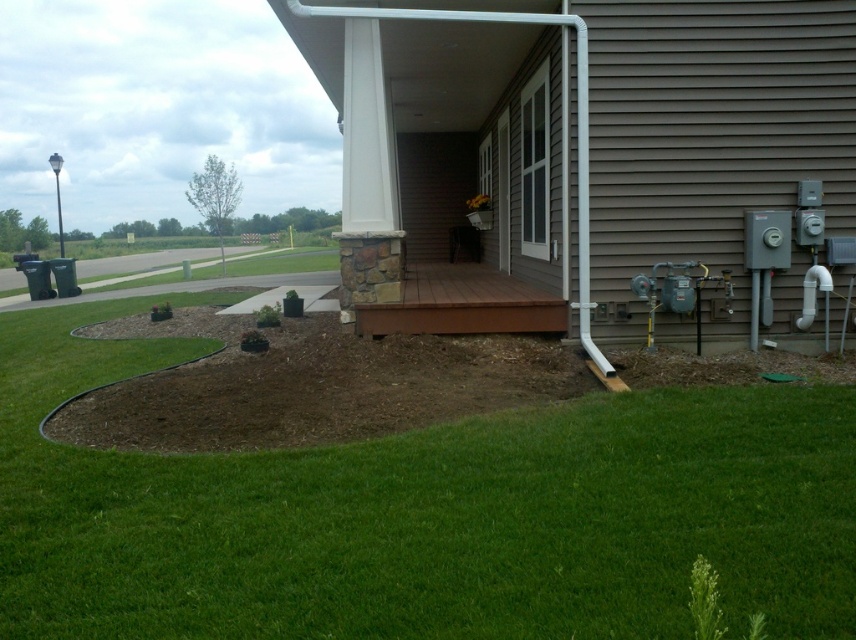
Question: Among these points, which one is farthest from the camera?

Choices:
 (A) 545,541
 (B) 411,298

Answer: (B)

Question: Which point is closer to the camera taking this photo?

Choices:
 (A) (102, 614)
 (B) (516, 324)

Answer: (A)

Question: Is green grass at lower center thinner than brown wood deck at center?

Choices:
 (A) yes
 (B) no

Answer: (A)

Question: In this image, where is green grass at lower center located relative to brown wood deck at center?

Choices:
 (A) above
 (B) below

Answer: (B)

Question: Does green grass at lower center have a smaller size compared to brown wood deck at center?

Choices:
 (A) yes
 (B) no

Answer: (A)

Question: Which point is farther to the camera?

Choices:
 (A) green grass at lower center
 (B) brown wood deck at center

Answer: (B)